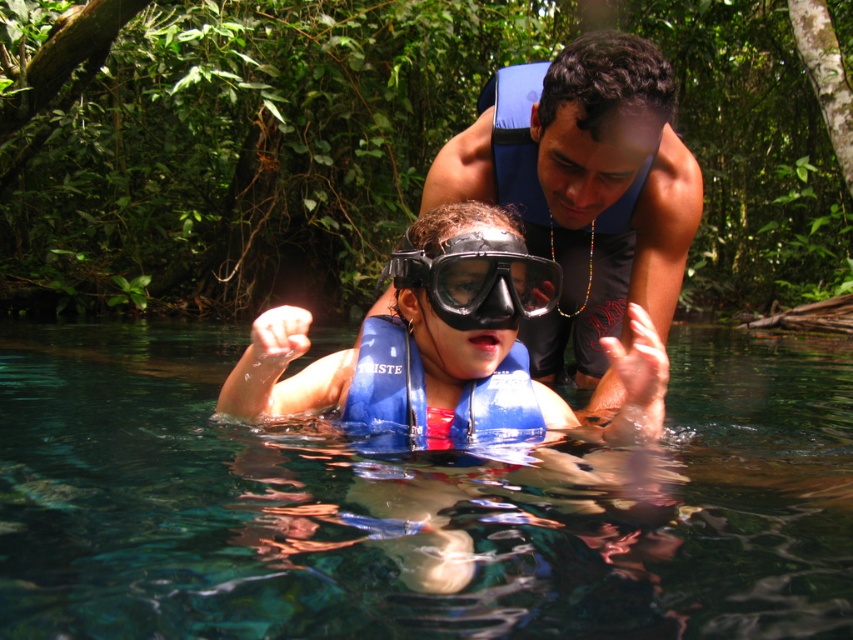
Based on the photo, you are a lifeguard observing two life preservers in the water. The transparent blue life vest at center and the blue matte life jacket at center. Which one is nearer to you?

The transparent blue life vest at center is closer to the viewer than the blue matte life jacket at center.

You are a lifeguard at a swimming pool and you see two life preservers in the water, the blue life vest at upper center and the blue matte life jacket at center. Which one is wider?

The blue life vest at upper center is wider than the blue matte life jacket at center.